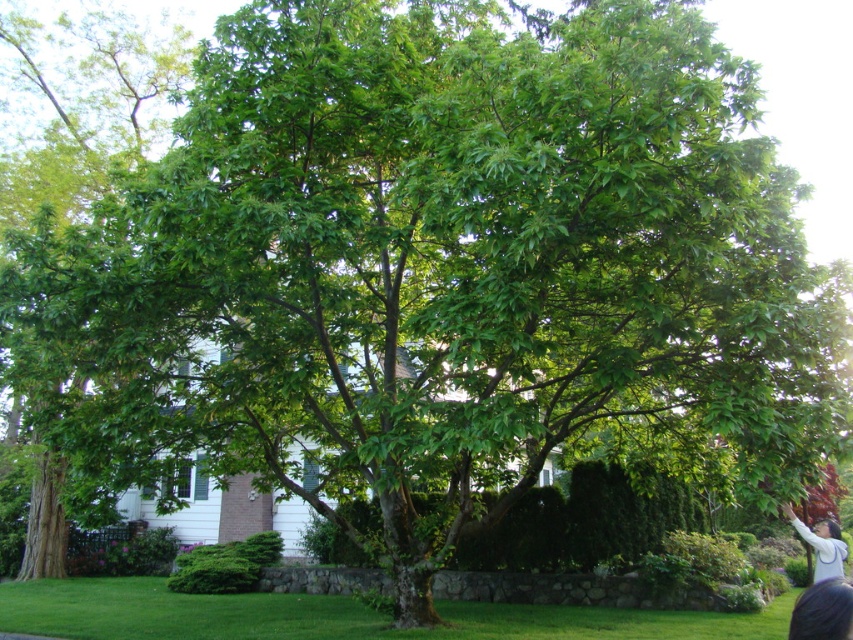
You are standing at the edge of the lawn in front of the house and notice a dark brown hair at lower right and a light gray sweater at lower right. If you want to pick up both items, which one should you walk towards first to minimize your walking distance?

Since the dark brown hair at lower right and the light gray sweater at lower right are only 5.77 meters apart, you can walk towards either one first as the distance between them is fixed. However, to minimize total walking distance, you should pick up whichever is closer to your current position first.

You are a photographer standing in front of the house and see the dark brown hair at lower right and the light gray sweater at lower right. Which object appears smaller in the image?

The dark brown hair at lower right is smaller than the light gray sweater at lower right, so the dark brown hair at lower right appears smaller.